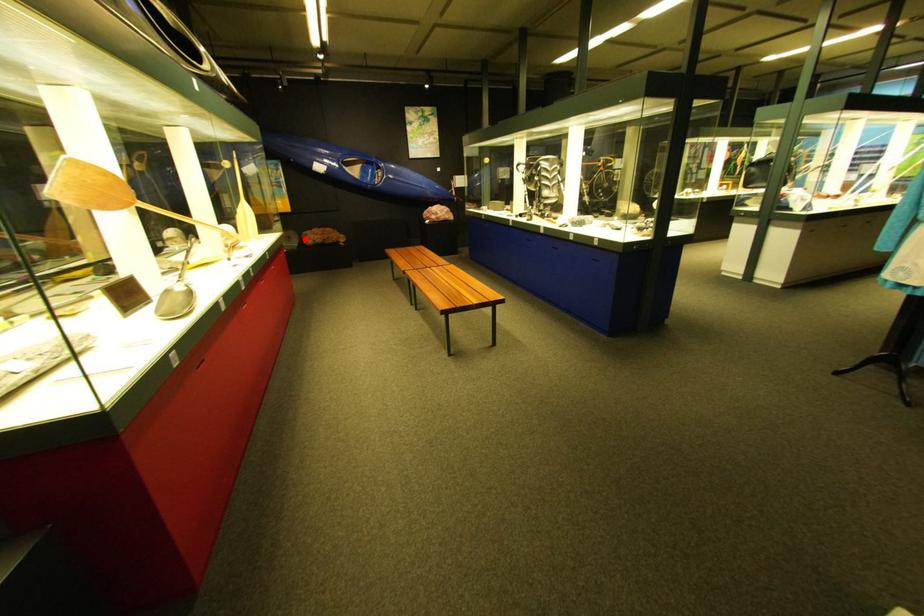
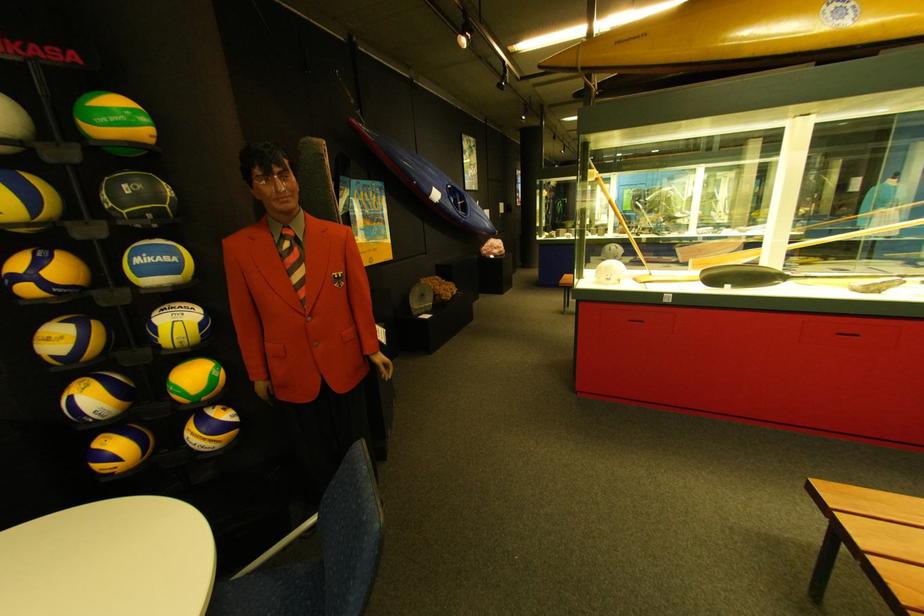
In the second image, find the point that corresponds to the highlighted location in the first image.

(438, 297)